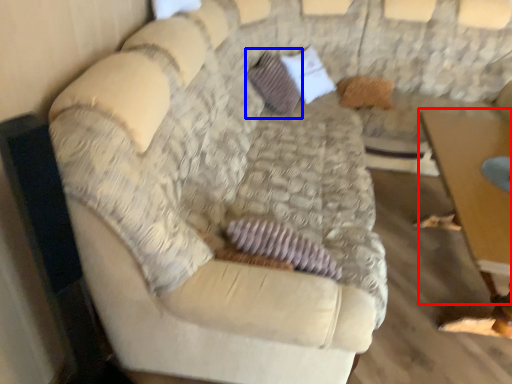
Question: Which object is closer to the camera taking this photo, table (highlighted by a red box) or pillow (highlighted by a blue box)?

Choices:
 (A) table
 (B) pillow

Answer: (A)